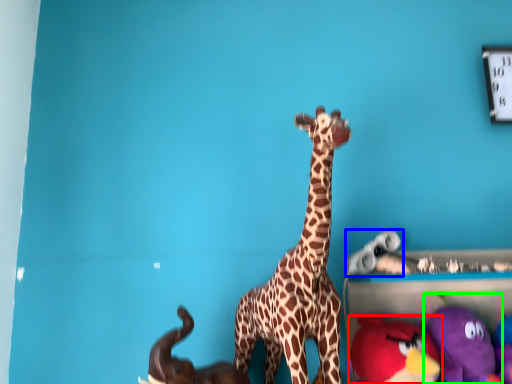
Question: Based on their relative distances, which object is farther from toy (highlighted by a red box)? Choose from toy (highlighted by a blue box) and toy (highlighted by a green box).

Choices:
 (A) toy
 (B) toy

Answer: (A)